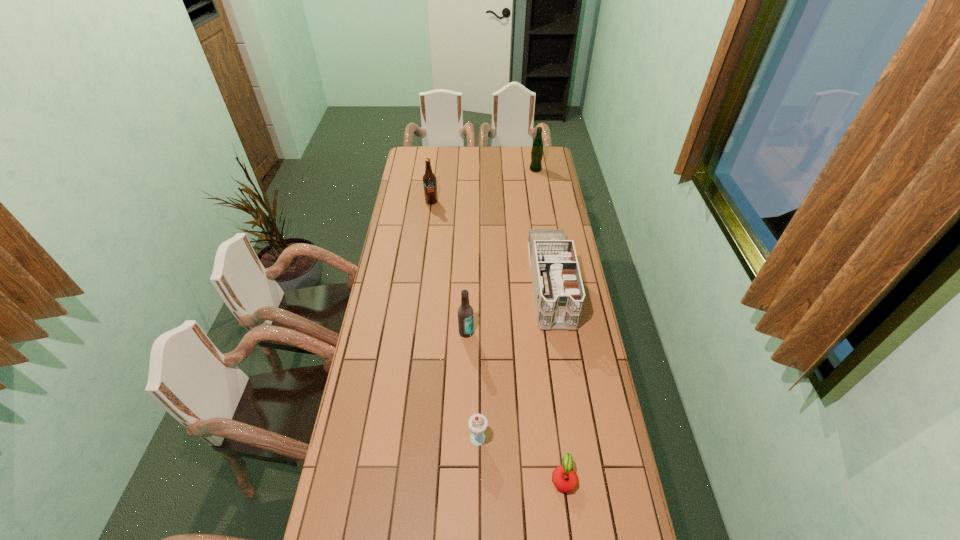
Find the location of `vacant space located on the label of the second nearest beer bottle`. vacant space located on the label of the second nearest beer bottle is located at coordinates coord(424,259).

I want to click on free space located 0.150m on the label of the second beer bottle from right to left, so click(x=466, y=372).

Identify the location of free space located at the entrance of the dollhouse. (563, 363).

At what (x,y) coordinates should I click in order to perform the action: click on free space located on the straw side of the milkshake. Please return your answer as a coordinate pair (x, y). The height and width of the screenshot is (540, 960). Looking at the image, I should click on (609, 435).

Locate an element on the screen. Image resolution: width=960 pixels, height=540 pixels. free space located 0.100m on the front of the apple is located at coordinates (570, 534).

The height and width of the screenshot is (540, 960). What are the coordinates of `object that is at the far edge` in the screenshot? It's located at (537, 147).

Where is `object present at the left edge`? The height and width of the screenshot is (540, 960). object present at the left edge is located at coordinates (429, 179).

Identify the location of beer bottle that is at the right edge. (537, 147).

This screenshot has height=540, width=960. Identify the location of dollhouse at the right edge. (558, 290).

Where is `apple that is at the right edge`? The height and width of the screenshot is (540, 960). apple that is at the right edge is located at coordinates (565, 479).